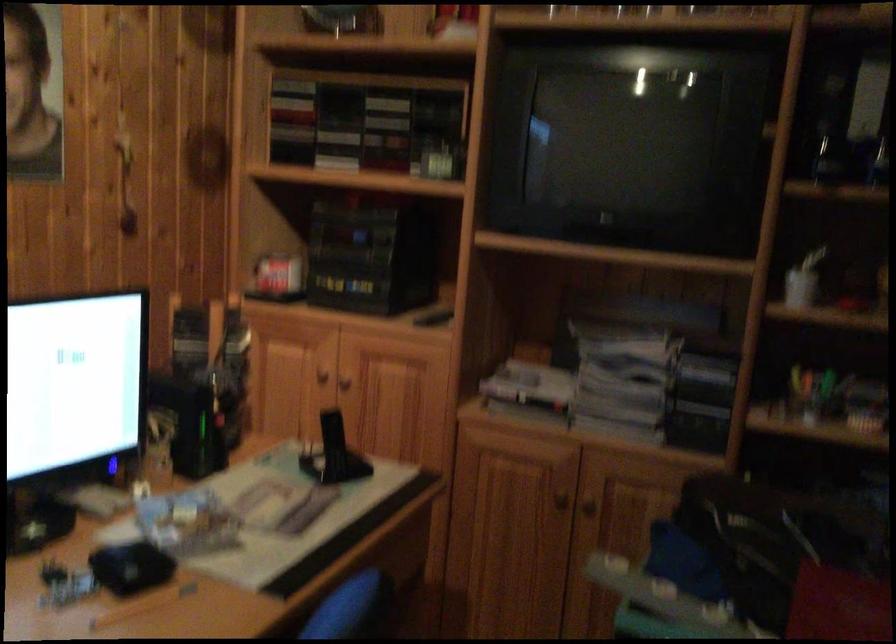
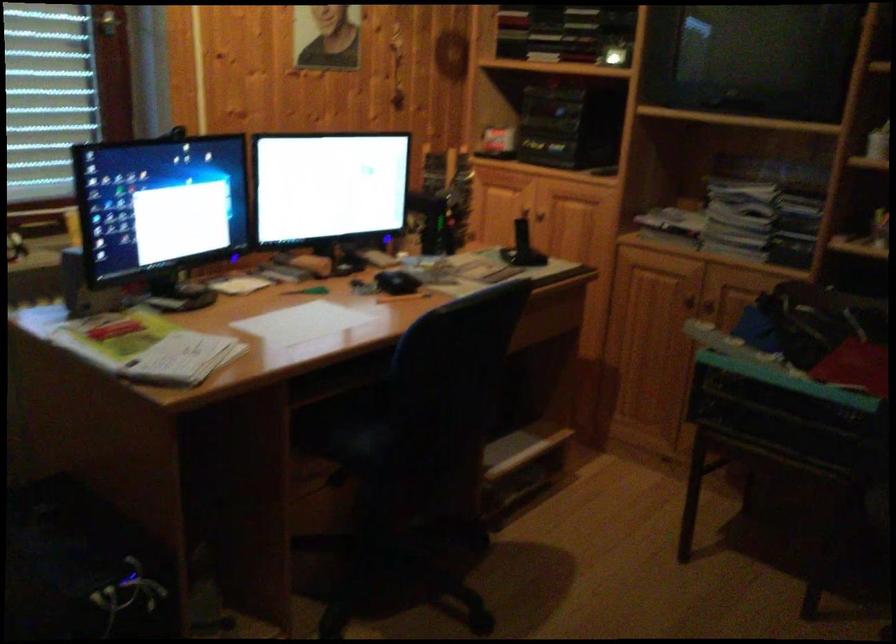
Question: What movement of the cameraman would produce the second image?

Choices:
 (A) Left
 (B) Right
 (C) Forward
 (D) Backward

Answer: (D)